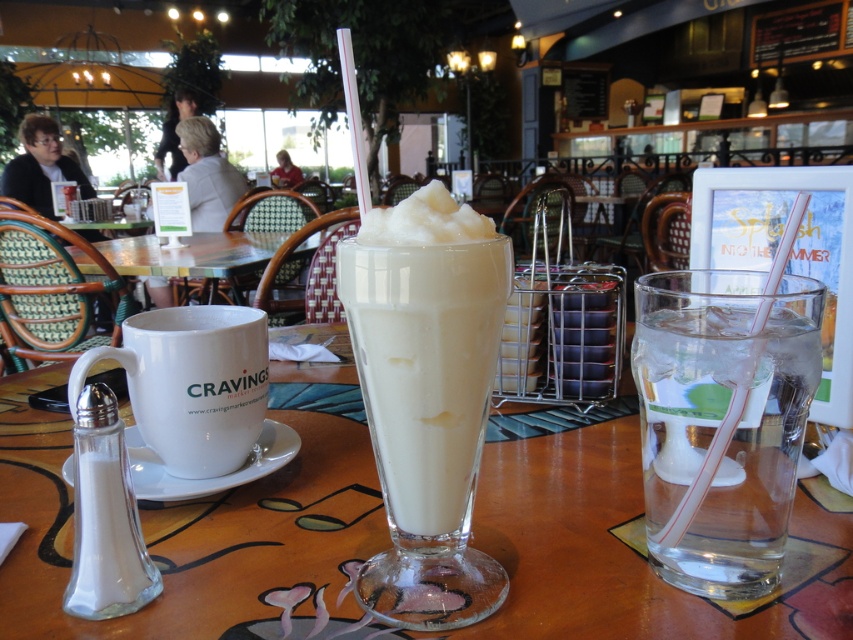
Is transparent glass at center thinner than white glossy table at center?

Yes, transparent glass at center is thinner than white glossy table at center.

Based on the photo, does transparent glass at center have a smaller size compared to white glossy table at center?

Indeed, transparent glass at center has a smaller size compared to white glossy table at center.

Who is more forward, (581, 625) or (238, 234)?

Positioned in front is point (581, 625).

Find the location of `transparent glass at center`. transparent glass at center is located at coordinates (387, 536).

In the scene shown: Is transparent glass at center taller than clear glass water at right?

No.

Is transparent glass at center above clear glass water at right?

Incorrect, transparent glass at center is not positioned above clear glass water at right.

Which is in front, point (825, 609) or point (751, 387)?

Point (751, 387) is in front.

Locate an element on the screen. The width and height of the screenshot is (853, 640). transparent glass at center is located at coordinates (387, 536).

Can you confirm if clear glass water at right is wider than white frothy milkshake at center?

No, clear glass water at right is not wider than white frothy milkshake at center.

Between clear glass water at right and white frothy milkshake at center, which one has less height?

With less height is clear glass water at right.

Is point (662, 406) more distant than point (456, 529)?

No, (662, 406) is in front of (456, 529).

What are the coordinates of `clear glass water at right` in the screenshot? It's located at (722, 420).